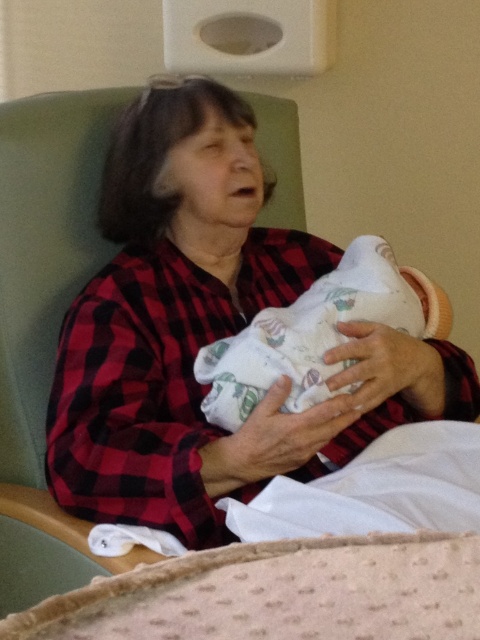
You are a photographer setting up for a portrait. You need to ensure that the red plaid shirt at center and the white soft swaddle at center are both visible in the frame. Based on their positions, which one should you focus on first to ensure proper composition?

The red plaid shirt at center is above the white soft swaddle at center, so you should focus on the red plaid shirt at center first to ensure it is in the upper part of the frame and properly composed with the lower positioned white soft swaddle at center.

You are a photographer trying to capture a closeup of the red plaid shirt at center in the scene. Given that your camera has a fixed focal length and you can only move forward or backward, where should you position yourself relative to the point marked at point (208, 332) to ensure the red plaid shirt at center is in focus?

The red plaid shirt at center is located at point (208, 332), so you should position yourself directly at that point to ensure the red plaid shirt at center is in focus.